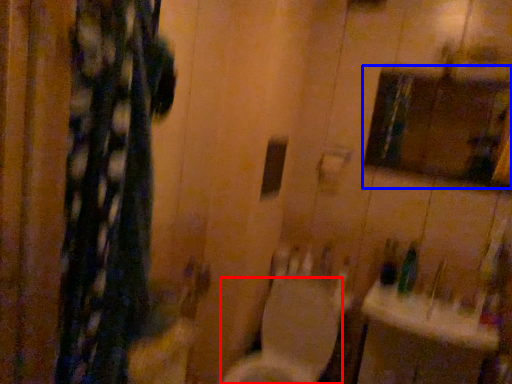
Question: Which object appears closest to the camera in this image, toilet (highlighted by a red box) or medicine cabinet (highlighted by a blue box)?

Choices:
 (A) toilet
 (B) medicine cabinet

Answer: (A)